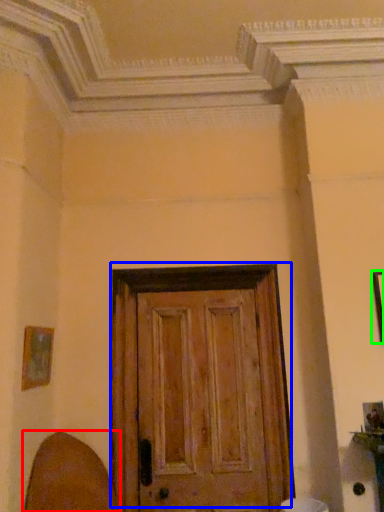
Question: Which object is the closest to the swivel chair (highlighted by a red box)? Choose among these: door (highlighted by a blue box) or picture frame (highlighted by a green box).

Choices:
 (A) door
 (B) picture frame

Answer: (A)